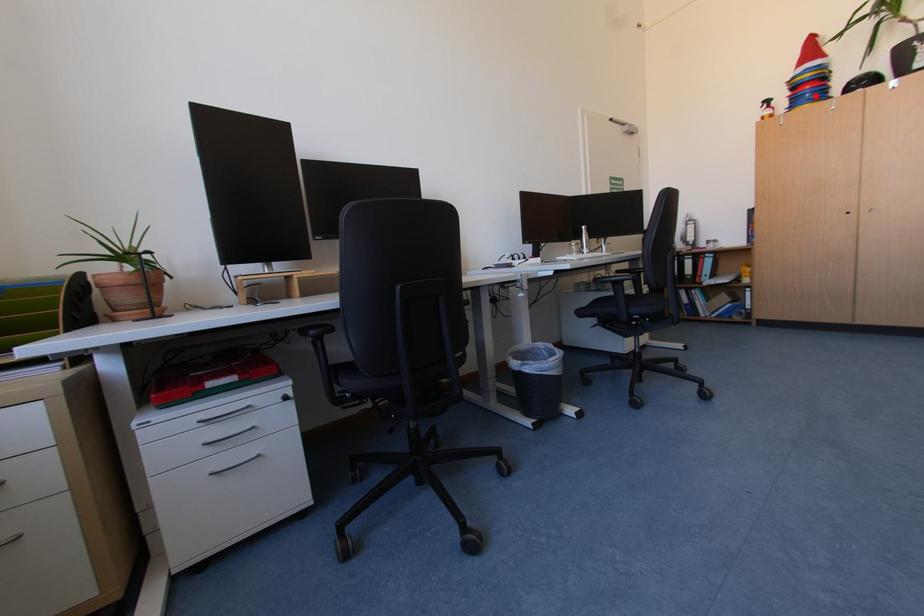
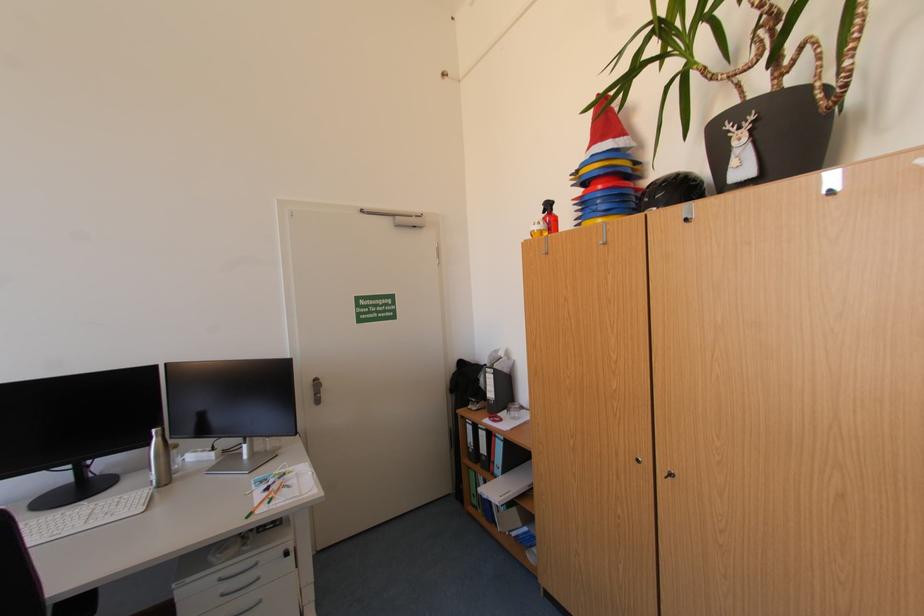
Question: I am providing you with two images of the same scene from different viewpoints. In image1, a red point is highlighted. Considering the same 3D point in image2, which of the following is correct?

Choices:
 (A) It is closer
 (B) It is farther

Answer: (A)